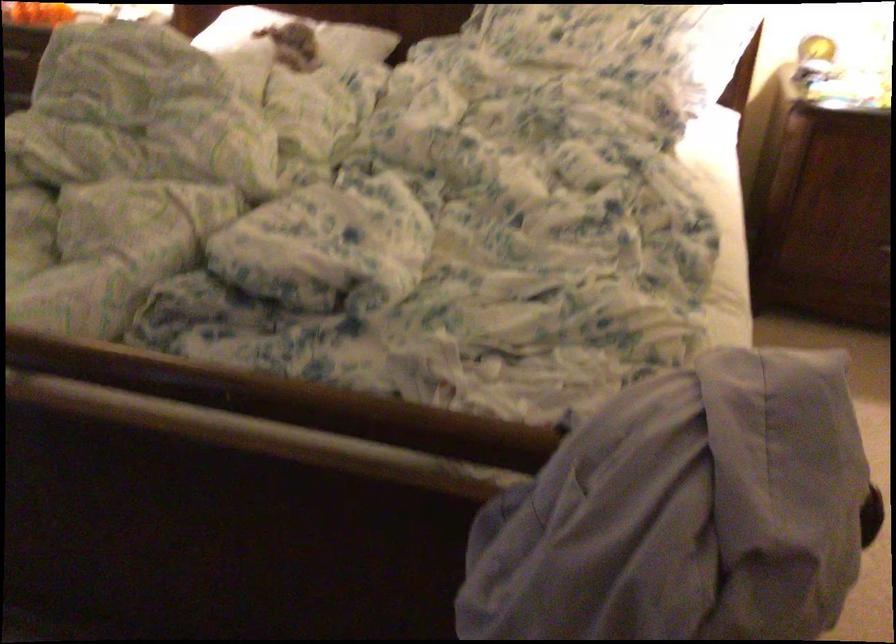
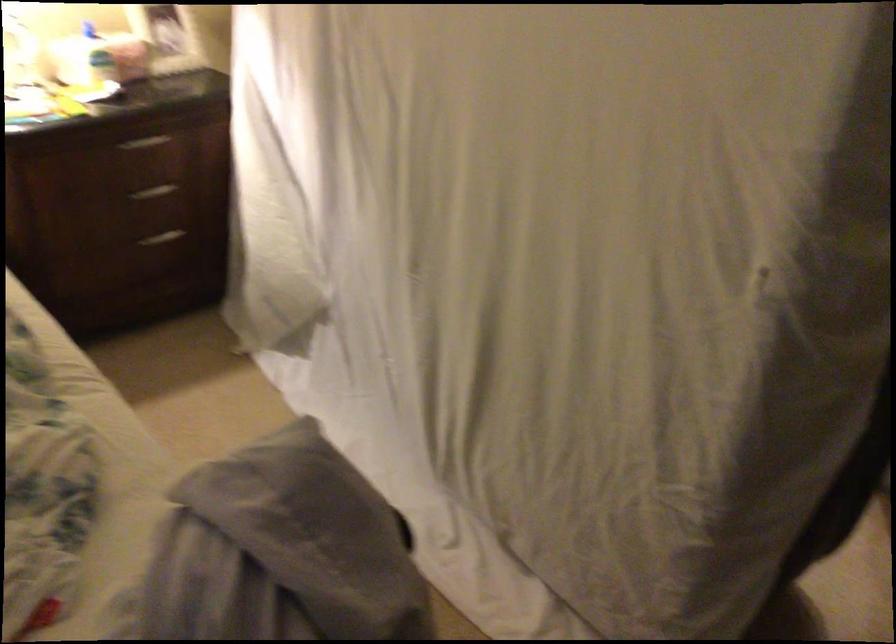
Question: The first image is from the beginning of the video and the second image is from the end. How did the camera likely rotate when shooting the video?

Choices:
 (A) Left
 (B) Right
 (C) Up
 (D) Down

Answer: (B)